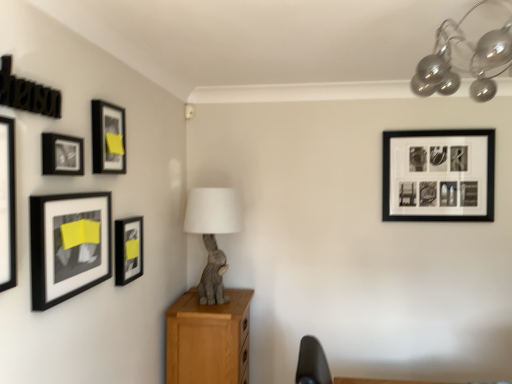
Question: Does matte black picture frame at upper left, the 3th picture frame positioned from the back, lie behind matte black picture frame at upper left, which is the 4th picture frame in back-to-front order?

Choices:
 (A) yes
 (B) no

Answer: (A)

Question: Would you say matte black picture frame at upper left, which is the 4th picture frame in left-to-right order, is a long distance from matte black picture frame at upper left, the 2th picture frame when ordered from left to right?

Choices:
 (A) yes
 (B) no

Answer: (B)

Question: Does matte black picture frame at upper left, arranged as the 4th picture frame when viewed from the front, have a larger size compared to matte black picture frame at upper left, which is the 4th picture frame in back-to-front order?

Choices:
 (A) yes
 (B) no

Answer: (A)

Question: Is matte black picture frame at upper left, which ranks as the third picture frame in right-to-left order, to the right of matte black picture frame at upper left, the 2th picture frame when ordered from left to right, from the viewer's perspective?

Choices:
 (A) no
 (B) yes

Answer: (B)

Question: Is the depth of matte black picture frame at upper left, the 3th picture frame positioned from the back, less than that of matte black picture frame at upper left, the third picture frame positioned from the front?

Choices:
 (A) no
 (B) yes

Answer: (A)

Question: From the image's perspective, is matte black picture frame at left, which is counted as the fifth picture frame, starting from the left, above or below gray fabric rabbit at center?

Choices:
 (A) above
 (B) below

Answer: (A)

Question: In terms of width, does matte black picture frame at left, the 5th picture frame in the front-to-back sequence, look wider or thinner when compared to gray fabric rabbit at center?

Choices:
 (A) thin
 (B) wide

Answer: (A)

Question: In the image, is matte black picture frame at left, the 2th picture frame positioned from the back, positioned in front of or behind gray fabric rabbit at center?

Choices:
 (A) behind
 (B) front

Answer: (B)

Question: Does point (116, 271) appear closer or farther from the camera than point (205, 200)?

Choices:
 (A) closer
 (B) farther

Answer: (A)

Question: In the image, is wooden cabinet at center positioned in front of or behind matte black picture frame at left, which is counted as the fifth picture frame, starting from the left?

Choices:
 (A) behind
 (B) front

Answer: (A)

Question: In terms of size, does wooden cabinet at center appear bigger or smaller than matte black picture frame at left, the 5th picture frame in the front-to-back sequence?

Choices:
 (A) small
 (B) big

Answer: (B)

Question: From a real-world perspective, relative to matte black picture frame at left, which is counted as the fifth picture frame, starting from the left, is wooden cabinet at center vertically above or below?

Choices:
 (A) above
 (B) below

Answer: (B)

Question: From the image's perspective, is wooden cabinet at center positioned above or below matte black picture frame at left, the 5th picture frame in the front-to-back sequence?

Choices:
 (A) below
 (B) above

Answer: (A)

Question: Choose the correct answer: Is matte black picture frame at upper left, which appears as the 5th picture frame when viewed from the right, inside black matte picture frame at upper right, marked as the first picture frame in a back-to-front arrangement, or outside it?

Choices:
 (A) outside
 (B) inside

Answer: (A)

Question: Would you say matte black picture frame at upper left, which appears as the 5th picture frame when viewed from the right, is to the left or to the right of black matte picture frame at upper right, the 6th picture frame from the left, in the picture?

Choices:
 (A) left
 (B) right

Answer: (A)